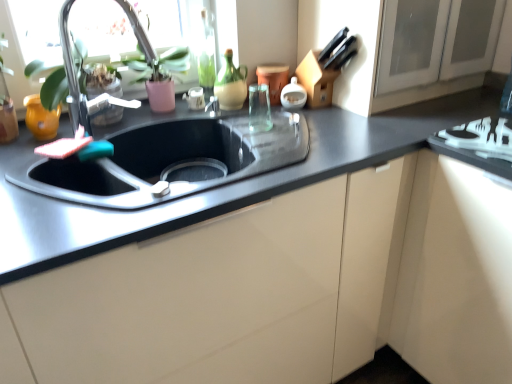
At what (x,y) coordinates should I click in order to perform the action: click on empty space that is to the right of white glossy soap dispenser at upper center, acting as the 1th appliance starting from the right. Please return your answer as a coordinate pair (x, y). Image resolution: width=512 pixels, height=384 pixels. Looking at the image, I should click on (342, 106).